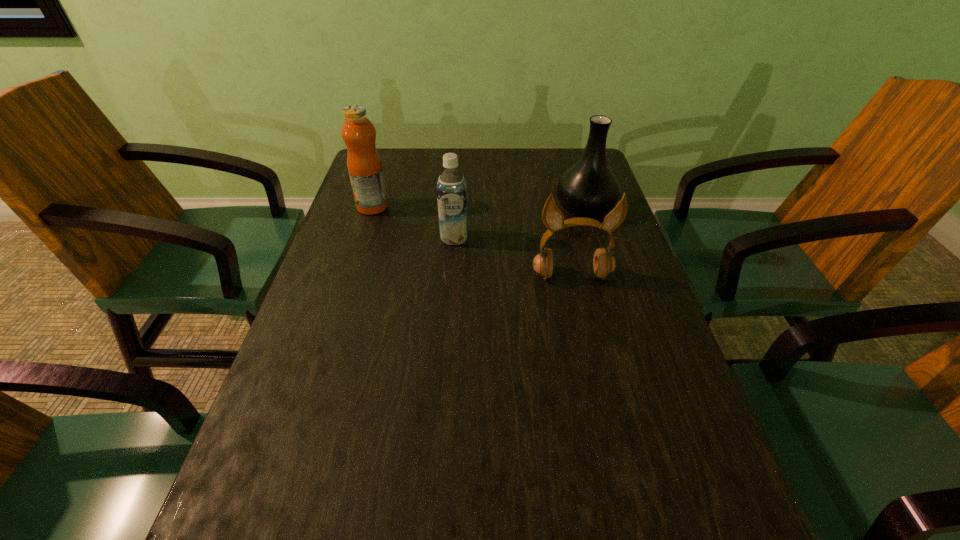
Identify the location of vase located in the right edge section of the desktop. Image resolution: width=960 pixels, height=540 pixels. (588, 189).

Find the location of `earphone at the right edge`. earphone at the right edge is located at coordinates (604, 263).

Where is `vacant space at the far edge`? The width and height of the screenshot is (960, 540). vacant space at the far edge is located at coordinates (432, 160).

Where is `vacant space at the left edge`? vacant space at the left edge is located at coordinates (391, 242).

Where is `vacant space at the right edge`? vacant space at the right edge is located at coordinates (637, 321).

This screenshot has width=960, height=540. I want to click on blank region between the nearest object and the fruit juice, so click(x=472, y=241).

The height and width of the screenshot is (540, 960). Identify the location of free spot between the earphone and the soya milk. (513, 256).

Image resolution: width=960 pixels, height=540 pixels. I want to click on vacant space that is in between the soya milk and the fruit juice, so click(x=414, y=222).

Locate an element on the screen. Image resolution: width=960 pixels, height=540 pixels. free space between the leftmost object and the third object from right to left is located at coordinates (414, 222).

The width and height of the screenshot is (960, 540). Identify the location of blank region between the earphone and the third farthest object. (513, 256).